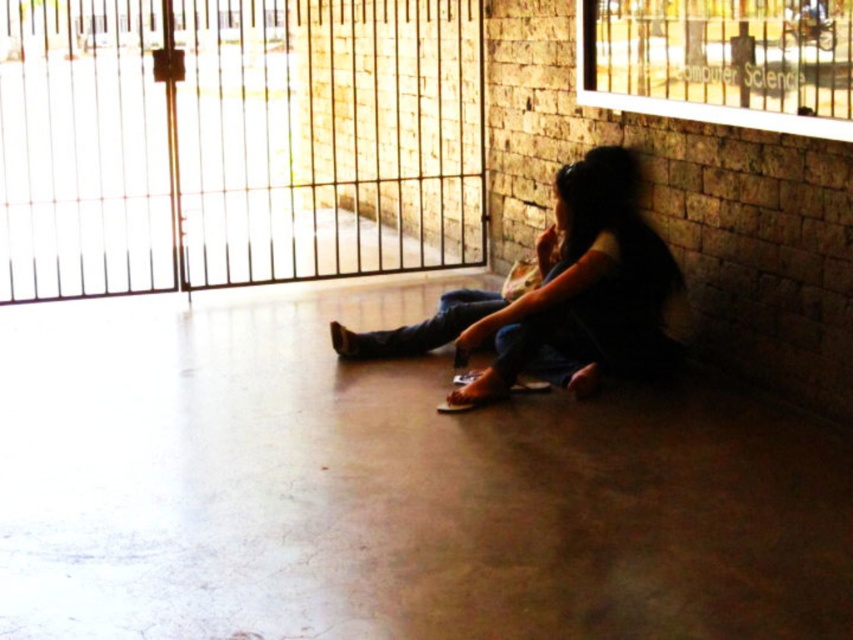
Question: Is black metal gate at upper left bigger than dark brown leather sandals at lower center?

Choices:
 (A) yes
 (B) no

Answer: (A)

Question: Is black metal gate at upper left to the left of dark brown leather sandals at lower center from the viewer's perspective?

Choices:
 (A) yes
 (B) no

Answer: (A)

Question: Which of the following is the farthest from the observer?

Choices:
 (A) black metal gate at upper left
 (B) jeans at center

Answer: (A)

Question: Which object appears closest to the camera in this image?

Choices:
 (A) dark brown leather sandals at lower center
 (B) jeans at center
 (C) black metal gate at upper left

Answer: (A)

Question: Which object is the closest to the dark brown leather sandals at lower center?

Choices:
 (A) black metal gate at upper left
 (B) jeans at center

Answer: (B)

Question: In this image, where is dark brown leather sandals at lower center located relative to jeans at center?

Choices:
 (A) left
 (B) right

Answer: (B)